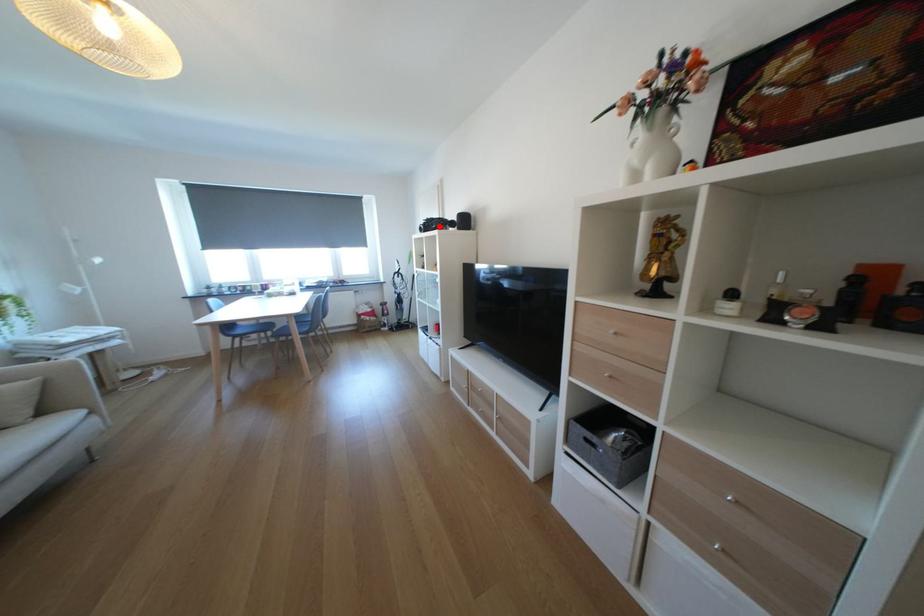
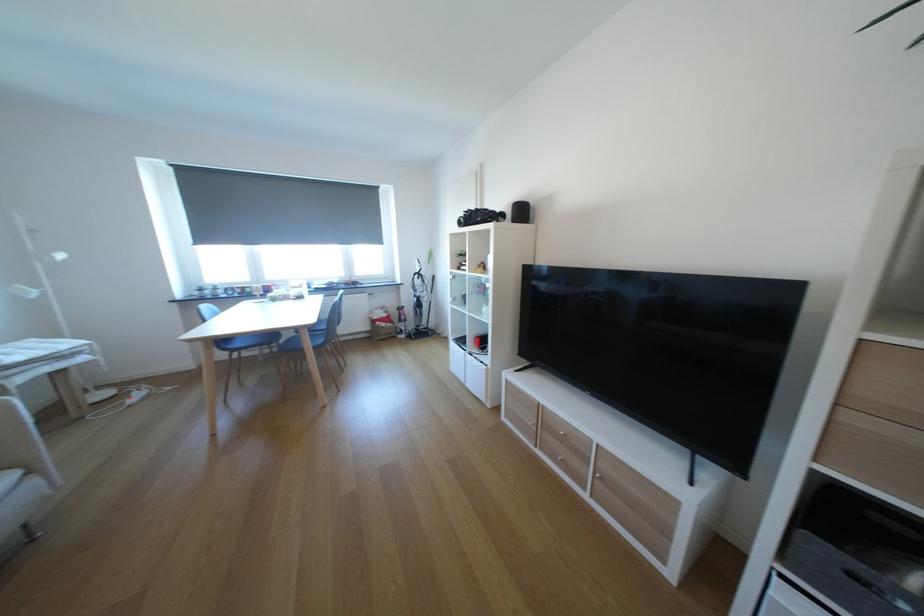
Find the pixel in the second image that matches the highlighted location in the first image.

(480, 219)